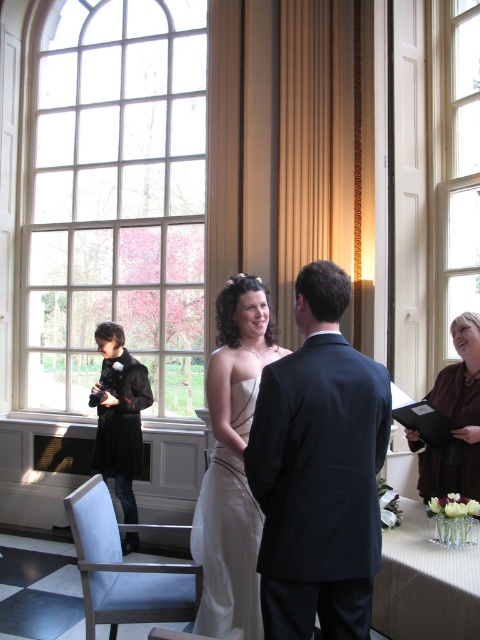
Based on the scene description, can you determine which object is shorter between the dark blue suit at center and the clear glass window at upper right?

The dark blue suit at center is shorter than the clear glass window at upper right according to the description.